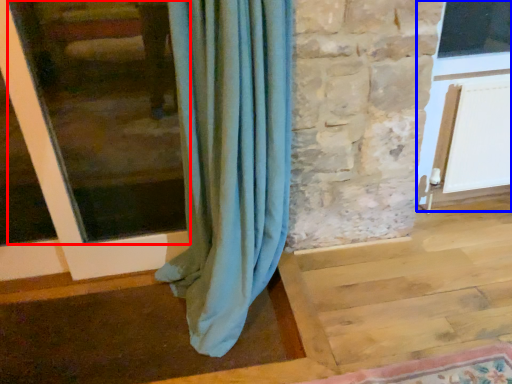
Question: Which point is closer to the camera, window frame (highlighted by a red box) or screen door (highlighted by a blue box)?

Choices:
 (A) window frame
 (B) screen door

Answer: (A)